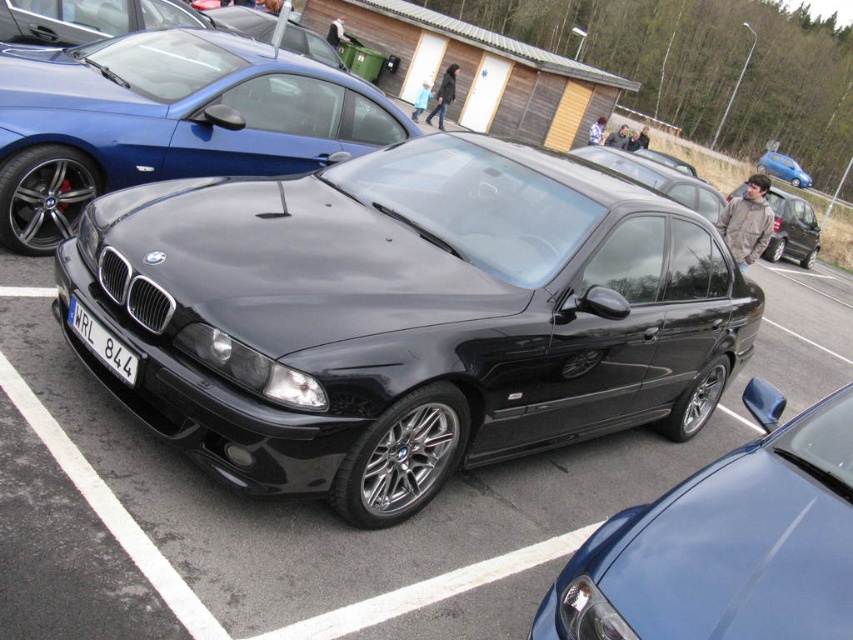
You are a parking attendant checking the parking lot. You see two cars at the center of the image, a black metallic car at center and a black matte sedan at center. Which one takes up less space in the parking lot?

The black metallic car at center takes up less space in the parking lot because it has a smaller size compared to the black matte sedan at center.

You are a parking attendant and need to move the black matte sedan at center. To do so, you must first determine if there is enough space between it and the metallic blue hatchback at upper right to maneuver out. Can you confirm if there is sufficient space?

The black matte sedan at center is positioned under the metallic blue hatchback at upper right, which means there is limited space between them. Therefore, there may not be enough room to maneuver the black matte sedan at center out safely without risking contact with the metallic blue hatchback at upper right.

You are a parking attendant checking if the black matte sedan at center and the metallic blue hatchback at upper right are within their designated parking spaces. Based on their sizes, which vehicle might require more space to park properly?

The metallic blue hatchback at upper right requires more space to park properly since the black matte sedan at center occupies less space than it.